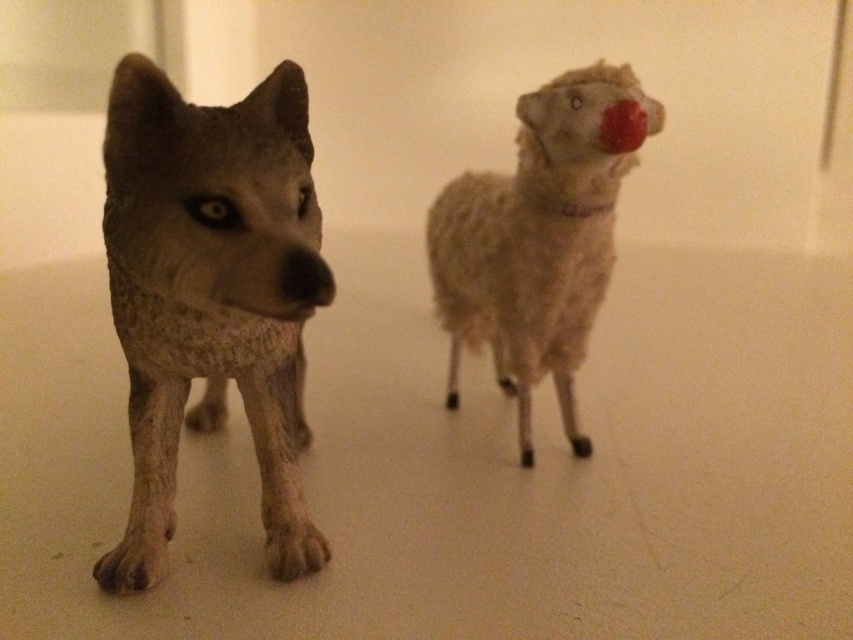
You are standing in front of a display with two figurines. You see the gray textured wolf at left and the fluffy white sheep at right. If you want to place a new figurine exactly halfway between them, where should you position it?

The gray textured wolf at left is located at point (x=212, y=294) and the fluffy white sheep at right is at point (x=212, y=417). The halfway point between them would be at the average of their coordinates. Calculating the average of the x coordinates gives 0.556, while the y coordinate remains 0.249. Therefore, you should position the new figurine at approximately (x=212, y=355).

You are a cat sitting on the floor. You see the gray textured wolf at left and the fuzzy beige sheep at center. Which object is closer to you?

The gray textured wolf at left is closer to you because it is positioned under the fuzzy beige sheep at center, indicating it is lower and thus nearer in the scene.